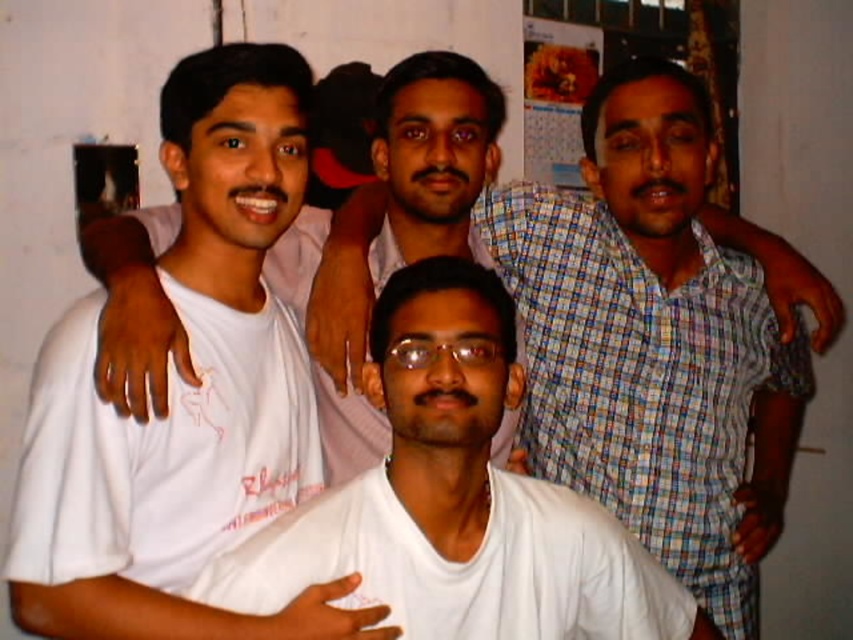
You are trying to take a photo of the transparent plastic glasses at center in the image. However, the white matte shirt at center is blocking your view. Can you move around to the side to get a clear shot of the glasses?

The white matte shirt at center is closer to the viewer than the transparent plastic glasses at center, so moving to the side might allow you to see around the shirt to capture the glasses.

In the scene shown: You are trying to identify the person wearing the white matte shirt at center in the group photo. Where would you look relative to the transparent plastic glasses at center?

The white matte shirt at center is located below the transparent plastic glasses at center, so you should look downward from the glasses to find the shirt.